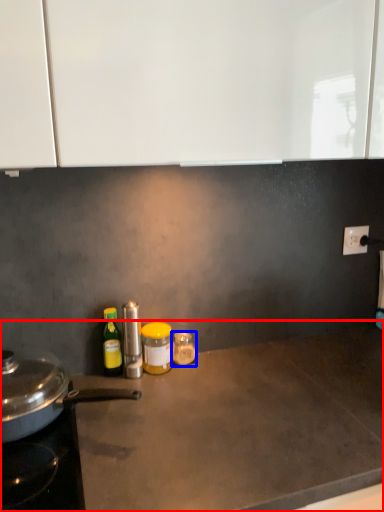
Question: Which of the following is the farthest to the observer, countertop (highlighted by a red box) or bottle (highlighted by a blue box)?

Choices:
 (A) countertop
 (B) bottle

Answer: (B)